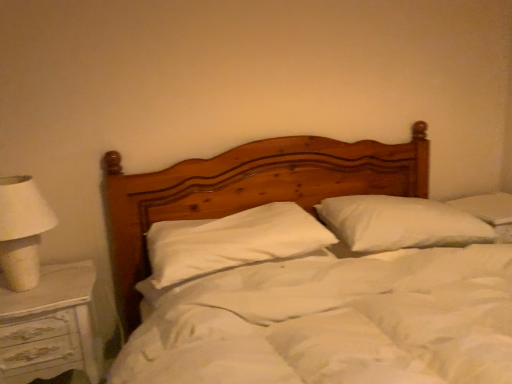
What do you see at coordinates (400, 223) in the screenshot? I see `white soft pillow at center, which is counted as the second pillow, starting from the left` at bounding box center [400, 223].

What is the approximate width of wooden bed at center?

It is 1.66 meters.

Describe the element at coordinates (50, 325) in the screenshot. I see `white painted wood nightstand at left` at that location.

Locate an element on the screen. white fabric lampshade at left is located at coordinates (22, 230).

Locate an element on the screen. Image resolution: width=512 pixels, height=384 pixels. white soft pillow at center, which is counted as the second pillow, starting from the left is located at coordinates (400, 223).

From a real-world perspective, is wooden bed at center over white fabric lampshade at left?

Incorrect, from a real-world perspective, wooden bed at center is lower than white fabric lampshade at left.

In the scene shown: Considering the relative sizes of wooden bed at center and white fabric lampshade at left in the image provided, is wooden bed at center smaller than white fabric lampshade at left?

No, wooden bed at center is not smaller than white fabric lampshade at left.

Is wooden bed at center not inside white fabric lampshade at left?

wooden bed at center is positioned outside white fabric lampshade at left.

From the image's perspective, who appears lower, wooden bed at center or white fabric lampshade at left?

wooden bed at center.

Who is bigger, white soft pillow at center, the 1th pillow when ordered from left to right, or wooden bed at center?

Bigger between the two is wooden bed at center.

In the scene shown: From their relative heights in the image, would you say white soft pillow at center, the 1th pillow when ordered from left to right, is taller or shorter than wooden bed at center?

Clearly, white soft pillow at center, the 1th pillow when ordered from left to right, is shorter compared to wooden bed at center.

Is the position of white soft pillow at center, the 1th pillow when ordered from left to right, less distant than that of wooden bed at center?

No, it is not.

Which of these two, white soft pillow at center, which is counted as the 2th pillow, starting from the right, or wooden bed at center, is thinner?

white soft pillow at center, which is counted as the 2th pillow, starting from the right.

Does white painted wood nightstand at left have a larger size compared to white soft pillow at center, which is counted as the 2th pillow, starting from the right?

Yes, white painted wood nightstand at left is bigger than white soft pillow at center, which is counted as the 2th pillow, starting from the right.

Can you confirm if white painted wood nightstand at left is thinner than white soft pillow at center, which is counted as the 2th pillow, starting from the right?

Yes, white painted wood nightstand at left is thinner than white soft pillow at center, which is counted as the 2th pillow, starting from the right.

Based on their positions, is white painted wood nightstand at left located to the left or right of white soft pillow at center, the 1th pillow when ordered from left to right?

Clearly, white painted wood nightstand at left is on the left of white soft pillow at center, the 1th pillow when ordered from left to right, in the image.

Is white painted wood nightstand at left located outside wooden bed at center?

white painted wood nightstand at left is positioned outside wooden bed at center.

Considering the sizes of objects white painted wood nightstand at left and wooden bed at center in the image provided, who is thinner, white painted wood nightstand at left or wooden bed at center?

white painted wood nightstand at left is thinner.

From the image's perspective, which is below, white painted wood nightstand at left or wooden bed at center?

white painted wood nightstand at left is shown below in the image.

Can you confirm if white soft pillow at center, which is counted as the second pillow, starting from the left, is positioned to the left of wooden bed at center?

In fact, white soft pillow at center, which is counted as the second pillow, starting from the left, is to the right of wooden bed at center.

Is white soft pillow at center, the 1th pillow in the right-to-left sequence, further to camera compared to wooden bed at center?

That is True.

From a real-world perspective, is white soft pillow at center, the 1th pillow in the right-to-left sequence, physically above wooden bed at center?

Correct, in the physical world, white soft pillow at center, the 1th pillow in the right-to-left sequence, is higher than wooden bed at center.

Is white soft pillow at center, which is counted as the second pillow, starting from the left, not inside wooden bed at center?

No, white soft pillow at center, which is counted as the second pillow, starting from the left, is inside or overlapping with wooden bed at center.

Is white fabric lampshade at left placed right next to white soft pillow at center, which is counted as the second pillow, starting from the left?

white fabric lampshade at left and white soft pillow at center, which is counted as the second pillow, starting from the left, are clearly separated.

From the image's perspective, is white fabric lampshade at left above or below white soft pillow at center, which is counted as the second pillow, starting from the left?

From the image's perspective, white fabric lampshade at left appears below white soft pillow at center, which is counted as the second pillow, starting from the left.

Can you confirm if white fabric lampshade at left is bigger than white soft pillow at center, which is counted as the second pillow, starting from the left?

Actually, white fabric lampshade at left might be smaller than white soft pillow at center, which is counted as the second pillow, starting from the left.

Does point (55, 224) appear closer or farther from the camera than point (439, 205)?

Clearly, point (55, 224) is closer to the camera than point (439, 205).

In the image, there is a white soft pillow at center, which is counted as the second pillow, starting from the left. At what (x,y) coordinates should I click in order to perform the action: click on nightstand below it (from a real-world perspective). Please return your answer as a coordinate pair (x, y). The image size is (512, 384). Looking at the image, I should click on (50, 325).

From a real-world perspective, is white painted wood nightstand at left positioned under white soft pillow at center, the 1th pillow in the right-to-left sequence, based on gravity?

Yes, from a real-world perspective, white painted wood nightstand at left is under white soft pillow at center, the 1th pillow in the right-to-left sequence.

Is white painted wood nightstand at left directly adjacent to white soft pillow at center, which is counted as the second pillow, starting from the left?

No, white painted wood nightstand at left is not with white soft pillow at center, which is counted as the second pillow, starting from the left.

In the scene shown: Is white painted wood nightstand at left to the left of white soft pillow at center, which is counted as the second pillow, starting from the left, from the viewer's perspective?

Indeed, white painted wood nightstand at left is positioned on the left side of white soft pillow at center, which is counted as the second pillow, starting from the left.

Find the location of a particular element. Image resolution: width=512 pixels, height=384 pixels. bed in front of the white fabric lampshade at left is located at coordinates (306, 270).

From a real-world perspective, count 2nd pillows upward from the wooden bed at center and point to it. Please provide its 2D coordinates.

[(232, 241)]

Based on their spatial positions, is wooden bed at center or white fabric lampshade at left further from white soft pillow at center, the 1th pillow in the right-to-left sequence?

Based on the image, white fabric lampshade at left appears to be further to white soft pillow at center, the 1th pillow in the right-to-left sequence.

Based on the photo, when comparing their distances from white soft pillow at center, the 1th pillow in the right-to-left sequence, does white fabric lampshade at left or white painted wood nightstand at left seem closer?

Based on the image, white painted wood nightstand at left appears to be nearer to white soft pillow at center, the 1th pillow in the right-to-left sequence.

When comparing their distances from white painted wood nightstand at left, does white fabric lampshade at left or white soft pillow at center, which is counted as the second pillow, starting from the left, seem further?

white soft pillow at center, which is counted as the second pillow, starting from the left.

Considering their positions, is white painted wood nightstand at left positioned further to white fabric lampshade at left than wooden bed at center?

wooden bed at center is further to white fabric lampshade at left.

When comparing their distances from wooden bed at center, does white fabric lampshade at left or white soft pillow at center, which is counted as the 2th pillow, starting from the right, seem closer?

The object closer to wooden bed at center is white soft pillow at center, which is counted as the 2th pillow, starting from the right.

In the scene shown: Which object lies nearer to the anchor point white soft pillow at center, the 1th pillow when ordered from left to right, wooden bed at center or white painted wood nightstand at left?

wooden bed at center is positioned closer to the anchor white soft pillow at center, the 1th pillow when ordered from left to right.

When comparing their distances from white fabric lampshade at left, does white soft pillow at center, which is counted as the 2th pillow, starting from the right, or white soft pillow at center, which is counted as the second pillow, starting from the left, seem further?

white soft pillow at center, which is counted as the second pillow, starting from the left.

Estimate the real-world distances between objects in this image. Which object is further from white painted wood nightstand at left, white soft pillow at center, which is counted as the 2th pillow, starting from the right, or wooden bed at center?

Among the two, wooden bed at center is located further to white painted wood nightstand at left.

Find the location of a particular element. nightstand between wooden bed at center and white soft pillow at center, which is counted as the 2th pillow, starting from the right, from front to back is located at coordinates (50, 325).

I want to click on nightstand situated between white fabric lampshade at left and white soft pillow at center, the 1th pillow when ordered from left to right, from left to right, so click(x=50, y=325).

You are a GUI agent. You are given a task and a screenshot of the screen. Output one action in this format:
    pyautogui.click(x=<x>, y=<y>)
    Task: Click on the lamp between wooden bed at center and white soft pillow at center, which is counted as the 2th pillow, starting from the right, along the z-axis
    Image resolution: width=512 pixels, height=384 pixels.
    Given the screenshot: What is the action you would take?
    pyautogui.click(x=22, y=230)

You are a GUI agent. You are given a task and a screenshot of the screen. Output one action in this format:
    pyautogui.click(x=<x>, y=<y>)
    Task: Click on the nightstand between wooden bed at center and white soft pillow at center, the 1th pillow in the right-to-left sequence, from front to back
    Image resolution: width=512 pixels, height=384 pixels.
    Given the screenshot: What is the action you would take?
    point(50,325)